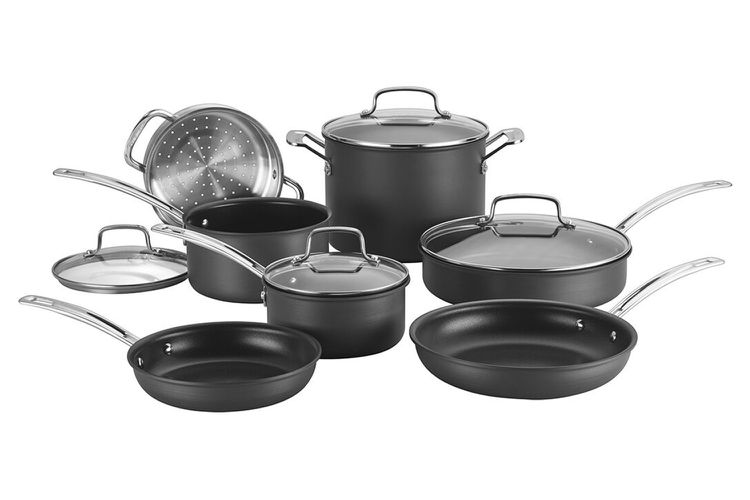
You are a GUI agent. You are given a task and a screenshot of the screen. Output one action in this format:
    pyautogui.click(x=<x>, y=<y>)
    Task: Click on the pots
    
    Given the screenshot: What is the action you would take?
    pyautogui.click(x=258, y=233), pyautogui.click(x=411, y=190), pyautogui.click(x=502, y=276), pyautogui.click(x=364, y=318)